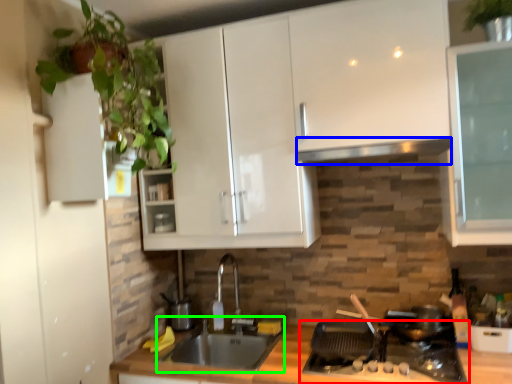
Question: Which object is positioned farthest from gas stove (highlighted by a red box)? Select from exhaust hood (highlighted by a blue box) and sink (highlighted by a green box).

Choices:
 (A) exhaust hood
 (B) sink

Answer: (A)